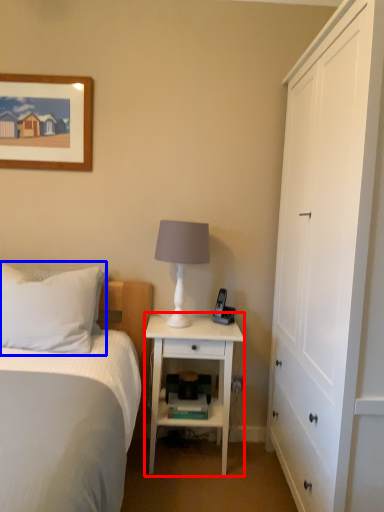
Question: Which point is closer to the camera, nightstand (highlighted by a red box) or pillow (highlighted by a blue box)?

Choices:
 (A) nightstand
 (B) pillow

Answer: (B)